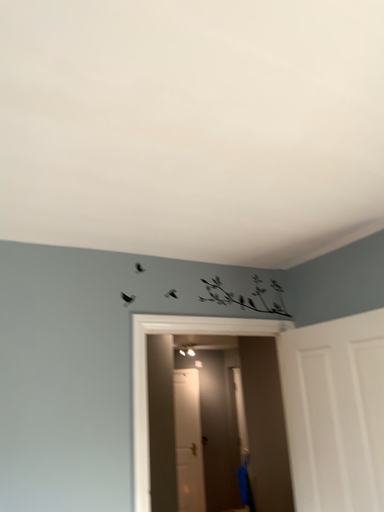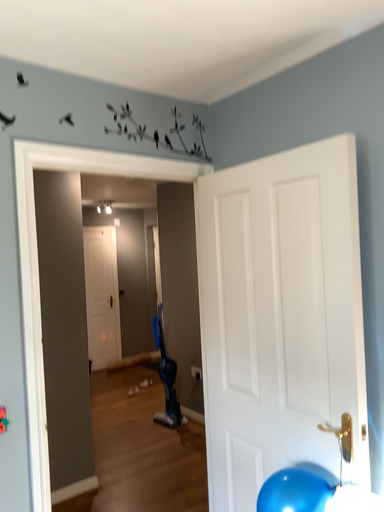
Question: How did the camera likely rotate when shooting the video?

Choices:
 (A) rotated right
 (B) rotated left

Answer: (A)